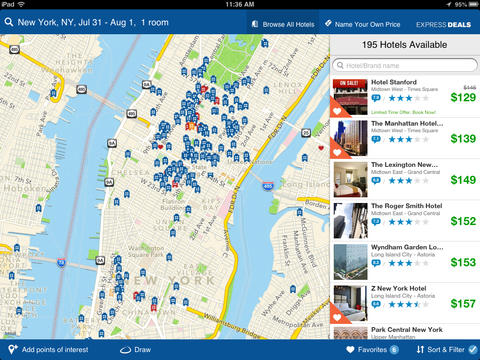
At what (x,y) coordinates should I click in order to perform the action: click on hotels. Please return your answer as a coordinate pair (x, y). The height and width of the screenshot is (360, 480). Looking at the image, I should click on (387, 41).